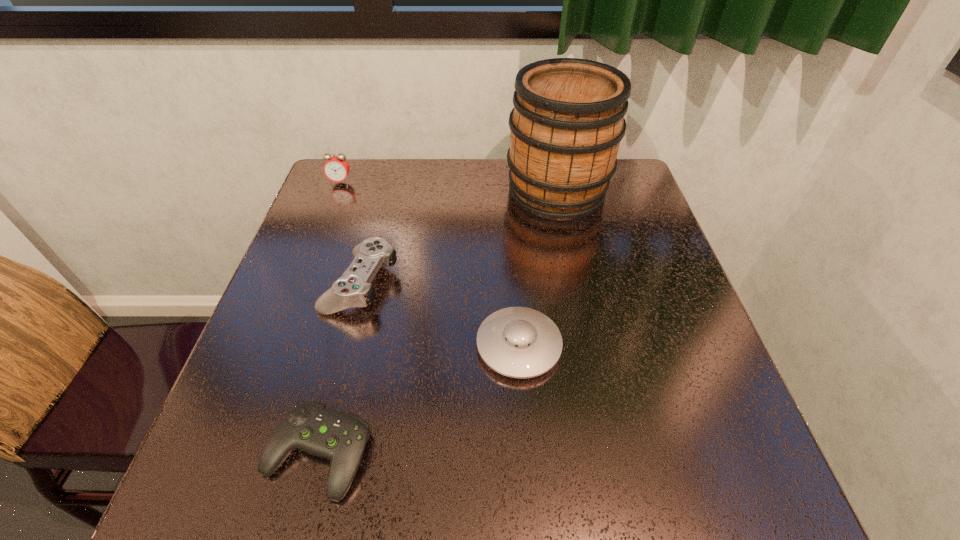
Image resolution: width=960 pixels, height=540 pixels. In order to click on object that is at the far right corner in this screenshot , I will do `click(568, 120)`.

Find the location of a particular element. This screenshot has width=960, height=540. free region at the far edge of the desktop is located at coordinates (492, 173).

Where is `vacant space at the left edge of the desktop`? vacant space at the left edge of the desktop is located at coordinates click(324, 387).

I want to click on free space at the right edge of the desktop, so click(612, 275).

You are a GUI agent. You are given a task and a screenshot of the screen. Output one action in this format:
    pyautogui.click(x=<x>, y=<y>)
    Task: Click on the unoccupied area between the cider and the shortest object
    
    Given the screenshot: What is the action you would take?
    pyautogui.click(x=437, y=322)

This screenshot has width=960, height=540. I want to click on vacant area that lies between the third shortest object and the alarm clock, so click(350, 232).

Locate an element on the screen. Image resolution: width=960 pixels, height=540 pixels. free space between the saucer and the cider is located at coordinates coord(538,269).

At what (x,y) coordinates should I click in order to perform the action: click on free space between the shorter control and the second tallest object. Please return your answer as a coordinate pair (x, y). Looking at the image, I should click on (329, 318).

Image resolution: width=960 pixels, height=540 pixels. In order to click on unoccupied area between the tallest object and the nearer control in this screenshot , I will do pos(437,322).

Where is `vacant space that's between the second tallest object and the shorter control`? This screenshot has height=540, width=960. vacant space that's between the second tallest object and the shorter control is located at coordinates (329, 318).